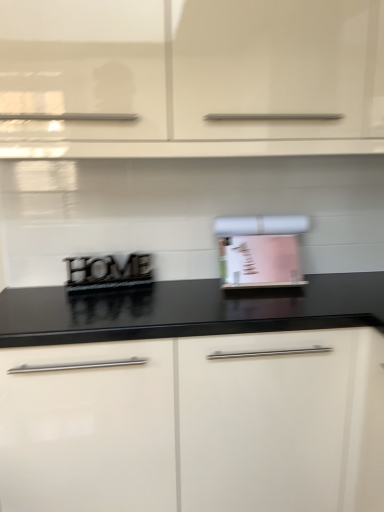
Where is `pink paper towel holder at center, which appears as the 2th appliance when viewed from the left`? pink paper towel holder at center, which appears as the 2th appliance when viewed from the left is located at coordinates (260, 250).

From the picture: In order to face white glossy cabinet at upper center, placed as the 2th cabinetry when sorted from bottom to top, should I rotate leftwards or rightwards?

Turn right by 2.960 degrees to look at white glossy cabinet at upper center, placed as the 2th cabinetry when sorted from bottom to top.

What is the approximate height of white glossy cabinet at upper center, which is counted as the 1th cabinetry, starting from the top?

white glossy cabinet at upper center, which is counted as the 1th cabinetry, starting from the top, is 19.35 inches in height.

What do you see at coordinates (197, 424) in the screenshot? The height and width of the screenshot is (512, 384). I see `white glossy cabinet at center, the 1th cabinetry when ordered from bottom to top` at bounding box center [197, 424].

You are a GUI agent. You are given a task and a screenshot of the screen. Output one action in this format:
    pyautogui.click(x=<x>, y=<y>)
    Task: Click on the metallic black sign at center, which ranks as the second appliance in right-to-left order
    This screenshot has height=512, width=384.
    Given the screenshot: What is the action you would take?
    pyautogui.click(x=107, y=272)

Which of these two, white glossy cabinet at upper center, placed as the 2th cabinetry when sorted from bottom to top, or white glossy cabinet at center, placed as the second cabinetry when sorted from top to bottom, stands taller?

white glossy cabinet at center, placed as the second cabinetry when sorted from top to bottom.

Is white glossy cabinet at upper center, placed as the 2th cabinetry when sorted from bottom to top, to the left or to the right of white glossy cabinet at center, placed as the second cabinetry when sorted from top to bottom, in the image?

white glossy cabinet at upper center, placed as the 2th cabinetry when sorted from bottom to top, is to the left of white glossy cabinet at center, placed as the second cabinetry when sorted from top to bottom.

Is white glossy cabinet at upper center, which is counted as the 1th cabinetry, starting from the top, not within white glossy cabinet at center, placed as the second cabinetry when sorted from top to bottom?

That's correct, white glossy cabinet at upper center, which is counted as the 1th cabinetry, starting from the top, is outside of white glossy cabinet at center, placed as the second cabinetry when sorted from top to bottom.

How many degrees apart are the facing directions of white glossy cabinet at upper center, which is counted as the 1th cabinetry, starting from the top, and white glossy cabinet at center, placed as the second cabinetry when sorted from top to bottom?

The facing directions of white glossy cabinet at upper center, which is counted as the 1th cabinetry, starting from the top, and white glossy cabinet at center, placed as the second cabinetry when sorted from top to bottom, are 0.372 degrees apart.

Considering the sizes of pink paper towel holder at center, which appears as the 2th appliance when viewed from the left, and metallic black sign at center, which ranks as the second appliance in right-to-left order, in the image, is pink paper towel holder at center, which appears as the 2th appliance when viewed from the left, wider or thinner than metallic black sign at center, which ranks as the second appliance in right-to-left order,?

pink paper towel holder at center, which appears as the 2th appliance when viewed from the left, is wider than metallic black sign at center, which ranks as the second appliance in right-to-left order.

Identify the location of appliance that appears on the left of pink paper towel holder at center, which appears as the 2th appliance when viewed from the left. The image size is (384, 512). (107, 272).

From a real-world perspective, who is located higher, pink paper towel holder at center, which appears as the 2th appliance when viewed from the left, or metallic black sign at center, which ranks as the second appliance in right-to-left order?

In real-world perspective, pink paper towel holder at center, which appears as the 2th appliance when viewed from the left, is above.

Are pink paper towel holder at center, the first appliance viewed from the right, and metallic black sign at center, which ranks as the second appliance in right-to-left order, far apart?

They are positioned close to each other.

Is white glossy cabinet at center, placed as the second cabinetry when sorted from top to bottom, to the left of pink paper towel holder at center, the first appliance viewed from the right, from the viewer's perspective?

Correct, you'll find white glossy cabinet at center, placed as the second cabinetry when sorted from top to bottom, to the left of pink paper towel holder at center, the first appliance viewed from the right.

Is point (288, 453) behind point (240, 221)?

No, it is not.

Is white glossy cabinet at center, placed as the second cabinetry when sorted from top to bottom, not close to pink paper towel holder at center, the first appliance viewed from the right?

That's not correct — white glossy cabinet at center, placed as the second cabinetry when sorted from top to bottom, is a little close to pink paper towel holder at center, the first appliance viewed from the right.

Is white glossy cabinet at center, the 1th cabinetry when ordered from bottom to top, aimed at pink paper towel holder at center, the first appliance viewed from the right?

No, white glossy cabinet at center, the 1th cabinetry when ordered from bottom to top, is not facing towards pink paper towel holder at center, the first appliance viewed from the right.

In terms of width, does metallic black sign at center, which ranks as the second appliance in right-to-left order, look wider or thinner when compared to white glossy cabinet at center, placed as the second cabinetry when sorted from top to bottom?

metallic black sign at center, which ranks as the second appliance in right-to-left order, is thinner than white glossy cabinet at center, placed as the second cabinetry when sorted from top to bottom.

Between metallic black sign at center, which ranks as the second appliance in right-to-left order, and white glossy cabinet at center, placed as the second cabinetry when sorted from top to bottom, which one has less height?

metallic black sign at center, which ranks as the second appliance in right-to-left order.

From the picture: From a real-world perspective, is metallic black sign at center, the first appliance when ordered from left to right, positioned under white glossy cabinet at center, the 1th cabinetry when ordered from bottom to top, based on gravity?

No, from a real-world perspective, metallic black sign at center, the first appliance when ordered from left to right, is not beneath white glossy cabinet at center, the 1th cabinetry when ordered from bottom to top.

Is there a large distance between metallic black sign at center, which ranks as the second appliance in right-to-left order, and white glossy cabinet at center, placed as the second cabinetry when sorted from top to bottom?

No, metallic black sign at center, which ranks as the second appliance in right-to-left order, is not far away from white glossy cabinet at center, placed as the second cabinetry when sorted from top to bottom.

From the image's perspective, which object appears higher, pink paper towel holder at center, the first appliance viewed from the right, or white glossy cabinet at center, the 1th cabinetry when ordered from bottom to top?

pink paper towel holder at center, the first appliance viewed from the right, from the image's perspective.

Is pink paper towel holder at center, which appears as the 2th appliance when viewed from the left, facing towards white glossy cabinet at center, the 1th cabinetry when ordered from bottom to top?

No, pink paper towel holder at center, which appears as the 2th appliance when viewed from the left, does not turn towards white glossy cabinet at center, the 1th cabinetry when ordered from bottom to top.

In the scene shown: Would you say pink paper towel holder at center, the first appliance viewed from the right, is outside white glossy cabinet at center, the 1th cabinetry when ordered from bottom to top?

Yes.

Does pink paper towel holder at center, which appears as the 2th appliance when viewed from the left, have a larger size compared to white glossy cabinet at center, placed as the second cabinetry when sorted from top to bottom?

No, pink paper towel holder at center, which appears as the 2th appliance when viewed from the left, is not bigger than white glossy cabinet at center, placed as the second cabinetry when sorted from top to bottom.

From a real-world perspective, is pink paper towel holder at center, which appears as the 2th appliance when viewed from the left, beneath white glossy cabinet at upper center, which is counted as the 1th cabinetry, starting from the top?

Yes, from a real-world perspective, pink paper towel holder at center, which appears as the 2th appliance when viewed from the left, is below white glossy cabinet at upper center, which is counted as the 1th cabinetry, starting from the top.

How far apart are pink paper towel holder at center, the first appliance viewed from the right, and white glossy cabinet at upper center, placed as the 2th cabinetry when sorted from bottom to top?

pink paper towel holder at center, the first appliance viewed from the right, is 47.25 centimeters from white glossy cabinet at upper center, placed as the 2th cabinetry when sorted from bottom to top.

Could you tell me if pink paper towel holder at center, which appears as the 2th appliance when viewed from the left, is facing white glossy cabinet at upper center, which is counted as the 1th cabinetry, starting from the top?

No, pink paper towel holder at center, which appears as the 2th appliance when viewed from the left, is not oriented towards white glossy cabinet at upper center, which is counted as the 1th cabinetry, starting from the top.

In the image, is pink paper towel holder at center, which appears as the 2th appliance when viewed from the left, on the left side or the right side of white glossy cabinet at upper center, placed as the 2th cabinetry when sorted from bottom to top?

From the image, it's evident that pink paper towel holder at center, which appears as the 2th appliance when viewed from the left, is to the right of white glossy cabinet at upper center, placed as the 2th cabinetry when sorted from bottom to top.

In the image, is white glossy cabinet at upper center, which is counted as the 1th cabinetry, starting from the top, on the left side or the right side of pink paper towel holder at center, the first appliance viewed from the right?

In the image, white glossy cabinet at upper center, which is counted as the 1th cabinetry, starting from the top, appears on the left side of pink paper towel holder at center, the first appliance viewed from the right.

From their relative heights in the image, would you say white glossy cabinet at upper center, which is counted as the 1th cabinetry, starting from the top, is taller or shorter than pink paper towel holder at center, the first appliance viewed from the right?

In the image, white glossy cabinet at upper center, which is counted as the 1th cabinetry, starting from the top, appears to be taller than pink paper towel holder at center, the first appliance viewed from the right.

Would you say pink paper towel holder at center, the first appliance viewed from the right, is part of white glossy cabinet at upper center, which is counted as the 1th cabinetry, starting from the top,'s contents?

No, pink paper towel holder at center, the first appliance viewed from the right, is located outside of white glossy cabinet at upper center, which is counted as the 1th cabinetry, starting from the top.

Does white glossy cabinet at upper center, which is counted as the 1th cabinetry, starting from the top, have a greater width compared to pink paper towel holder at center, the first appliance viewed from the right?

Yes, white glossy cabinet at upper center, which is counted as the 1th cabinetry, starting from the top, is wider than pink paper towel holder at center, the first appliance viewed from the right.

This screenshot has width=384, height=512. What are the coordinates of `cabinetry in front of the white glossy cabinet at center, placed as the second cabinetry when sorted from top to bottom` in the screenshot? It's located at (191, 77).

Where is `appliance below the pink paper towel holder at center, which appears as the 2th appliance when viewed from the left (from a real-world perspective)`? The image size is (384, 512). appliance below the pink paper towel holder at center, which appears as the 2th appliance when viewed from the left (from a real-world perspective) is located at coordinates (107, 272).

Considering their positions, is metallic black sign at center, the first appliance when ordered from left to right, positioned further to white glossy cabinet at upper center, which is counted as the 1th cabinetry, starting from the top, than pink paper towel holder at center, the first appliance viewed from the right?

Based on the image, metallic black sign at center, the first appliance when ordered from left to right, appears to be further to white glossy cabinet at upper center, which is counted as the 1th cabinetry, starting from the top.

Based on the photo, estimate the real-world distances between objects in this image. Which object is further from metallic black sign at center, the first appliance when ordered from left to right, pink paper towel holder at center, the first appliance viewed from the right, or white glossy cabinet at upper center, which is counted as the 1th cabinetry, starting from the top?

white glossy cabinet at upper center, which is counted as the 1th cabinetry, starting from the top, is further to metallic black sign at center, the first appliance when ordered from left to right.

When comparing their distances from metallic black sign at center, the first appliance when ordered from left to right, does white glossy cabinet at upper center, which is counted as the 1th cabinetry, starting from the top, or pink paper towel holder at center, the first appliance viewed from the right, seem closer?

pink paper towel holder at center, the first appliance viewed from the right.

Which object lies nearer to the anchor point white glossy cabinet at upper center, placed as the 2th cabinetry when sorted from bottom to top, white glossy cabinet at center, the 1th cabinetry when ordered from bottom to top, or metallic black sign at center, the first appliance when ordered from left to right?

The object closer to white glossy cabinet at upper center, placed as the 2th cabinetry when sorted from bottom to top, is metallic black sign at center, the first appliance when ordered from left to right.

Looking at this image, looking at the image, which one is located closer to metallic black sign at center, which ranks as the second appliance in right-to-left order, white glossy cabinet at center, the 1th cabinetry when ordered from bottom to top, or white glossy cabinet at upper center, which is counted as the 1th cabinetry, starting from the top?

white glossy cabinet at center, the 1th cabinetry when ordered from bottom to top.

Based on their spatial positions, is white glossy cabinet at center, the 1th cabinetry when ordered from bottom to top, or pink paper towel holder at center, which appears as the 2th appliance when viewed from the left, further from metallic black sign at center, which ranks as the second appliance in right-to-left order?

white glossy cabinet at center, the 1th cabinetry when ordered from bottom to top.

From the image, which object appears to be nearer to pink paper towel holder at center, the first appliance viewed from the right, white glossy cabinet at upper center, placed as the 2th cabinetry when sorted from bottom to top, or metallic black sign at center, which ranks as the second appliance in right-to-left order?

metallic black sign at center, which ranks as the second appliance in right-to-left order, lies closer to pink paper towel holder at center, the first appliance viewed from the right, than the other object.

Based on their spatial positions, is metallic black sign at center, the first appliance when ordered from left to right, or white glossy cabinet at upper center, placed as the 2th cabinetry when sorted from bottom to top, further from white glossy cabinet at center, the 1th cabinetry when ordered from bottom to top?

Among the two, white glossy cabinet at upper center, placed as the 2th cabinetry when sorted from bottom to top, is located further to white glossy cabinet at center, the 1th cabinetry when ordered from bottom to top.

Where is `appliance between white glossy cabinet at upper center, placed as the 2th cabinetry when sorted from bottom to top, and metallic black sign at center, the first appliance when ordered from left to right, from top to bottom`? This screenshot has height=512, width=384. appliance between white glossy cabinet at upper center, placed as the 2th cabinetry when sorted from bottom to top, and metallic black sign at center, the first appliance when ordered from left to right, from top to bottom is located at coordinates (260, 250).

The width and height of the screenshot is (384, 512). In order to click on appliance between pink paper towel holder at center, the first appliance viewed from the right, and white glossy cabinet at center, placed as the second cabinetry when sorted from top to bottom, in the vertical direction in this screenshot , I will do `click(107, 272)`.